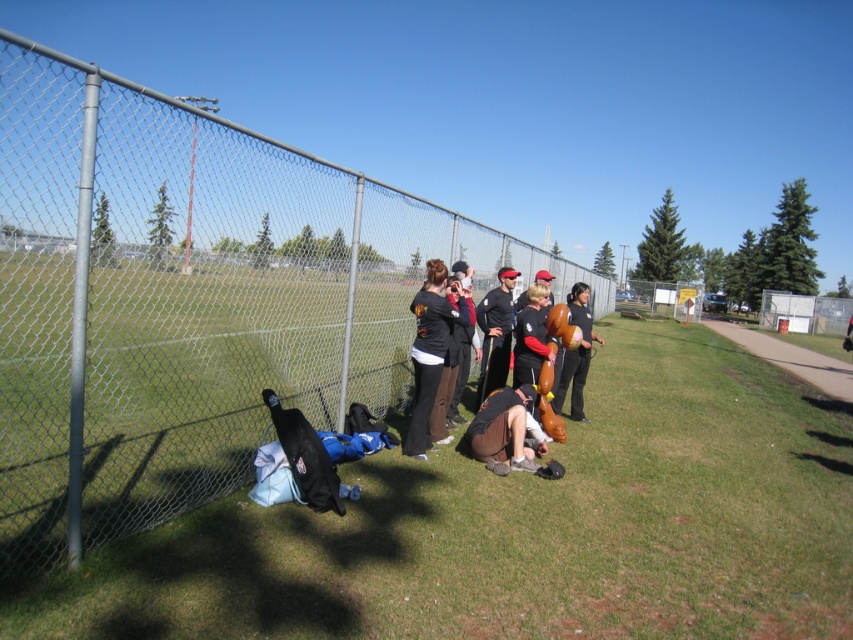
Between metal chain-link fence at center and black matte t-shirt at center, which one has more height?

Standing taller between the two is metal chain-link fence at center.

Does metal chain-link fence at center have a lesser width compared to black matte t-shirt at center?

Incorrect, metal chain-link fence at center's width is not less than black matte t-shirt at center's.

Is point (235, 232) positioned after point (469, 288)?

No, it is not.

Identify the location of metal chain-link fence at center. (184, 298).

Between green grass at center and black matte baseball cap at center, which one is positioned higher?

black matte baseball cap at center is higher up.

At what (x,y) coordinates should I click in order to perform the action: click on green grass at center. Please return your answer as a coordinate pair (x, y). Looking at the image, I should click on (524, 528).

Does point (55, 611) lie in front of point (505, 352)?

Yes, point (55, 611) is closer to viewer.

The image size is (853, 640). What are the coordinates of `green grass at center` in the screenshot? It's located at (524, 528).

Which of these two, matte black balloon at right or black matte t-shirt at center, stands taller?

With more height is matte black balloon at right.

Who is shorter, matte black balloon at right or black matte t-shirt at center?

black matte t-shirt at center

Where is `matte black balloon at right`? matte black balloon at right is located at coordinates (576, 353).

Locate an element on the screen. matte black balloon at right is located at coordinates (576, 353).